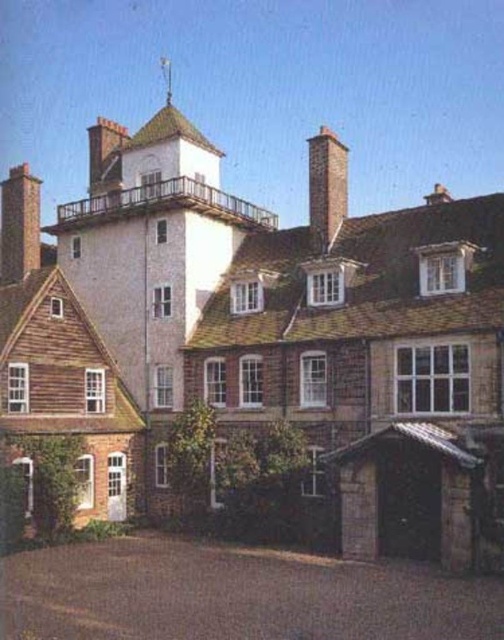
You are standing in front of the building and notice two chimneys. The brick chimney at left and the smooth brick chimney at upper center. Which one is closer to you?

The brick chimney at left is closer to the viewer than the smooth brick chimney at upper center.

You are standing in front of the building and notice a point marked at coordinates (327, 188). Which object does this point correspond to?

The point at coordinates (327, 188) corresponds to the red brick chimney at upper right.